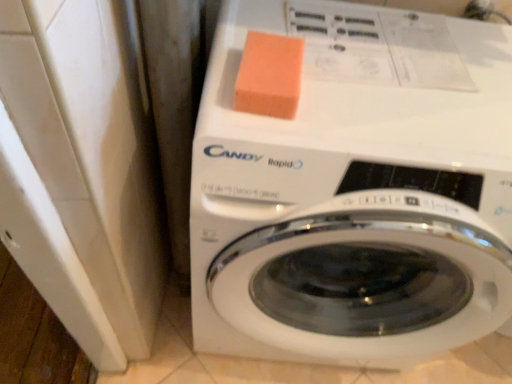
Question: Considering the positions of point (421, 76) and point (268, 92), is point (421, 76) closer or farther from the camera than point (268, 92)?

Choices:
 (A) farther
 (B) closer

Answer: (A)

Question: Which is correct: white glossy washing machine at center is inside orange sponge at upper center, or outside of it?

Choices:
 (A) outside
 (B) inside

Answer: (A)

Question: From a real-world perspective, is white glossy washing machine at center physically located above or below orange sponge at upper center?

Choices:
 (A) above
 (B) below

Answer: (B)

Question: Is orange sponge at upper center wider or thinner than white glossy washing machine at center?

Choices:
 (A) thin
 (B) wide

Answer: (A)

Question: From their relative heights in the image, would you say orange sponge at upper center is taller or shorter than white glossy washing machine at center?

Choices:
 (A) tall
 (B) short

Answer: (B)

Question: Is point (267, 81) closer or farther from the camera than point (269, 326)?

Choices:
 (A) closer
 (B) farther

Answer: (A)

Question: From a real-world perspective, relative to white glossy washing machine at center, is orange sponge at upper center vertically above or below?

Choices:
 (A) above
 (B) below

Answer: (A)